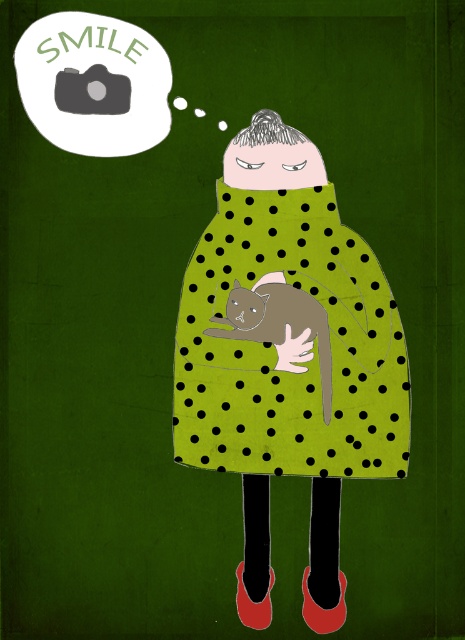
Based on the photo, is green dotted blanket at center in front of gray soft cat at center?

Yes, green dotted blanket at center is in front of gray soft cat at center.

Looking at this image, who is positioned more to the right, green dotted blanket at center or gray soft cat at center?

From the viewer's perspective, gray soft cat at center appears more on the right side.

This screenshot has width=465, height=640. In order to click on green dotted blanket at center in this screenshot , I will do `click(281, 340)`.

The height and width of the screenshot is (640, 465). I want to click on green dotted blanket at center, so click(281, 340).

Is matte black camera at upper left below green matte hand at center?

No, matte black camera at upper left is not below green matte hand at center.

Does point (150, 74) lie behind point (278, 362)?

No, it is not.

This screenshot has width=465, height=640. I want to click on matte black camera at upper left, so click(x=93, y=83).

Is gray soft cat at center wider than green matte hand at center?

Correct, the width of gray soft cat at center exceeds that of green matte hand at center.

Is gray soft cat at center in front of green matte hand at center?

That is True.

What do you see at coordinates (280, 326) in the screenshot? This screenshot has width=465, height=640. I see `gray soft cat at center` at bounding box center [280, 326].

At what (x,y) coordinates should I click in order to perform the action: click on gray soft cat at center. Please return your answer as a coordinate pair (x, y). Looking at the image, I should click on (280, 326).